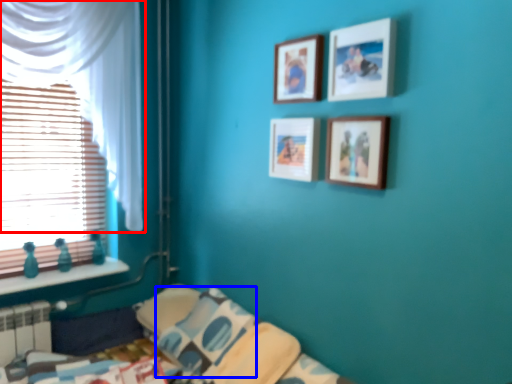
Question: Which point is further to the camera, curtain (highlighted by a red box) or pillow (highlighted by a blue box)?

Choices:
 (A) curtain
 (B) pillow

Answer: (B)